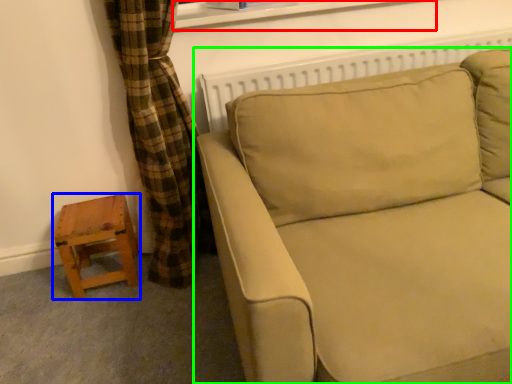
Question: Which is farther away from window frame (highlighted by a red box)? stool (highlighted by a blue box) or studio couch (highlighted by a green box)?

Choices:
 (A) stool
 (B) studio couch

Answer: (A)